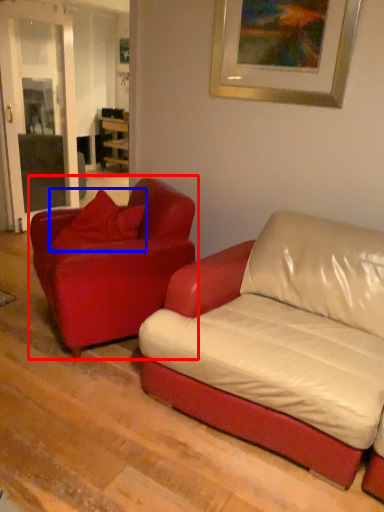
Question: Which of the following is the closest to the observer, studio couch (highlighted by a red box) or pillow (highlighted by a blue box)?

Choices:
 (A) studio couch
 (B) pillow

Answer: (A)